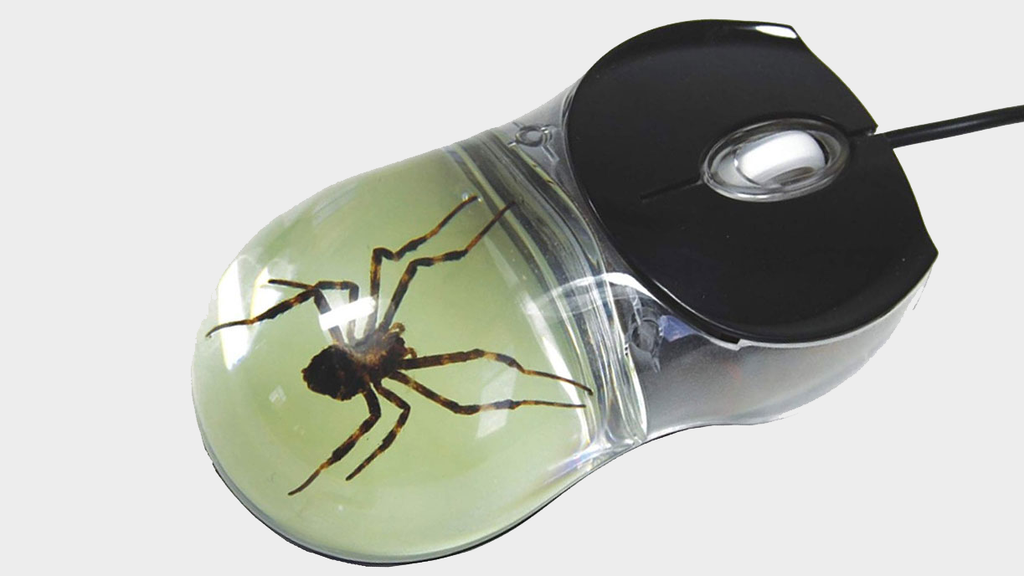
Locate an element on the screen. The image size is (1024, 576). part that connects mouse to computer is located at coordinates (928, 130).